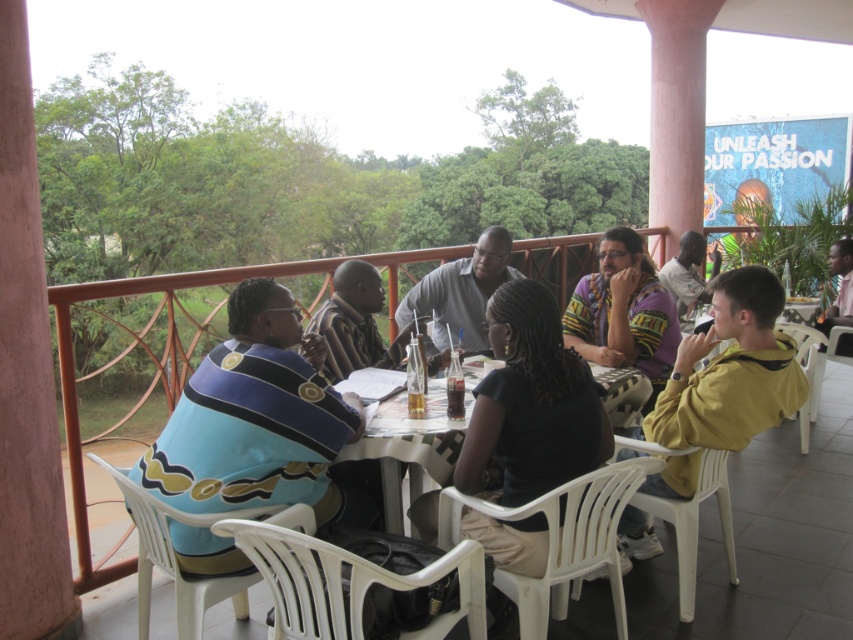
You are a photographer trying to capture a group photo of the people around the table. You need to ensure that both the yellow fleece jacket at right and the white plastic table at center are visible in the frame. Given their heights, which object might block the view of the other if positioned improperly?

The yellow fleece jacket at right is taller than the white plastic table at center, so if positioned between the camera and the table, the jacket could block the view of the table.

You are a delivery person who needs to place a small package on the table without disturbing the people seated around it. The package is 12 inches wide. Is there enough space between the white plastic table at center and the light gray shirt at center to safely place the package?

The distance between the white plastic table at center and the light gray shirt at center is 24.55 inches. Since the package is 12 inches wide, there is sufficient space to place it safely without disturbing the light gray shirt at center.

You are a caterer setting up for a small event and need to place a 1.2 meter wide cake on the table. Given the white plastic table at center and the light gray shirt at center, can the cake fit on the table?

The white plastic table at center has a width less than the light gray shirt at center, so the cake may not fit since the table is narrower than the shirt. However, without knowing the exact dimensions of the shirt, it is impossible to determine if the table is wide enough for the 1.2 meter cake.